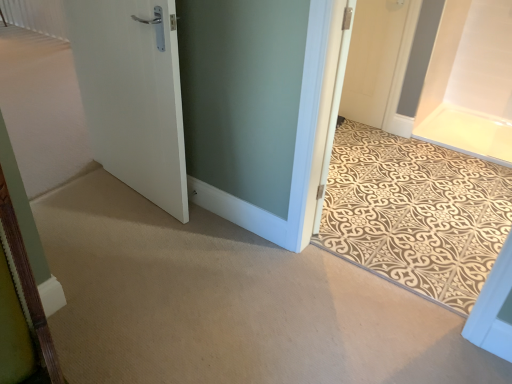
Measure the distance between point [383,45] and camera.

A distance of 2.92 meters exists between point [383,45] and camera.

Find the location of `white matte door at left, marked as the 2th door in a front-to-back arrangement`. white matte door at left, marked as the 2th door in a front-to-back arrangement is located at coordinates tap(182, 117).

Is white matte door at upper right, acting as the 1th door starting from the back, completely or partially inside white matte door at left, which ranks as the second door in left-to-right order?

No, white matte door at left, which ranks as the second door in left-to-right order, does not contain white matte door at upper right, acting as the 1th door starting from the back.

From the image's perspective, which door is the 1st one above the white matte door at left, marked as the 1th door in a front-to-back arrangement? Please provide its 2D coordinates.

[(377, 59)]

Is white matte door at left, marked as the 1th door in a front-to-back arrangement, positioned before white matte door at upper right, which is the 1th door from right to left?

Yes, it is.

Consider the image. From the image's perspective, between white matte door at left, acting as the 3th door starting from the back, and white matte door at upper right, acting as the 3th door starting from the front, which one is located above?

From the image's view, white matte door at upper right, acting as the 3th door starting from the front, is above.

From their relative heights in the image, would you say beige patterned mat at center is taller or shorter than white matte door at upper right, acting as the 1th door starting from the back?

In the image, beige patterned mat at center appears to be taller than white matte door at upper right, acting as the 1th door starting from the back.

From a real-world perspective, who is located higher, beige patterned mat at center or white matte door at upper right, marked as the 3th door in a left-to-right arrangement?

From a 3D spatial view, beige patterned mat at center is above.

Is beige patterned mat at center to the right of white matte door at upper right, acting as the 1th door starting from the back, from the viewer's perspective?

No, beige patterned mat at center is not to the right of white matte door at upper right, acting as the 1th door starting from the back.

Does point (398, 162) appear closer or farther from the camera than point (402, 77)?

Point (398, 162) is closer to the camera than point (402, 77).

Are white matte door at left, marked as the 2th door in a front-to-back arrangement, and white matte door at left, which ranks as the second door in left-to-right order, making contact?

Indeed, white matte door at left, marked as the 2th door in a front-to-back arrangement, and white matte door at left, which ranks as the second door in left-to-right order, are beside each other and touching.

Could you tell me if white matte door at left, marked as the 2th door in a front-to-back arrangement, is facing white matte door at left, which ranks as the second door in left-to-right order?

No, white matte door at left, marked as the 2th door in a front-to-back arrangement, is not aimed at white matte door at left, which ranks as the second door in left-to-right order.

Is white matte door at left, arranged as the 1th door when viewed from the left, bigger than white matte door at left, positioned as the second door in right-to-left order?

Correct, white matte door at left, arranged as the 1th door when viewed from the left, is larger in size than white matte door at left, positioned as the second door in right-to-left order.

From a real-world perspective, is white matte door at left, the 2th door from the back, positioned under white matte door at left, marked as the 1th door in a front-to-back arrangement, based on gravity?

Yes.

Considering the relative positions of white matte door at left, arranged as the 1th door when viewed from the left, and white matte door at upper right, acting as the 3th door starting from the front, in the image provided, is white matte door at left, arranged as the 1th door when viewed from the left, to the right of white matte door at upper right, acting as the 3th door starting from the front, from the viewer's perspective?

No.

From the picture: In terms of size, does white matte door at left, the 3th door from the right, appear bigger or smaller than white matte door at upper right, which is the 1th door from right to left?

Clearly, white matte door at left, the 3th door from the right, is larger in size than white matte door at upper right, which is the 1th door from right to left.

From the image's perspective, is white matte door at left, the 2th door from the back, under white matte door at upper right, marked as the 3th door in a left-to-right arrangement?

No, from the image's perspective, white matte door at left, the 2th door from the back, is not beneath white matte door at upper right, marked as the 3th door in a left-to-right arrangement.

Measure the distance from white matte door at left, the 2th door from the back, to white matte door at upper right, acting as the 1th door starting from the back.

The distance of white matte door at left, the 2th door from the back, from white matte door at upper right, acting as the 1th door starting from the back, is 4.99 feet.

Is white matte door at left, marked as the 1th door in a front-to-back arrangement, positioned beyond the bounds of beige patterned mat at center?

white matte door at left, marked as the 1th door in a front-to-back arrangement, is positioned outside beige patterned mat at center.

Is there a large distance between white matte door at left, marked as the 1th door in a front-to-back arrangement, and beige patterned mat at center?

Absolutely, white matte door at left, marked as the 1th door in a front-to-back arrangement, is distant from beige patterned mat at center.

Is white matte door at upper right, acting as the 1th door starting from the back, not near white matte door at left, positioned as the second door in right-to-left order?

Yes, white matte door at upper right, acting as the 1th door starting from the back, and white matte door at left, positioned as the second door in right-to-left order, are located far from each other.

Based on the photo, from the image's perspective, which one is positioned higher, white matte door at upper right, acting as the 3th door starting from the front, or white matte door at left, acting as the 3th door starting from the back?

white matte door at upper right, acting as the 3th door starting from the front, appears higher in the image.

This screenshot has height=384, width=512. I want to click on door above the white matte door at upper right, which is the 1th door from right to left (from a real-world perspective), so click(x=133, y=94).

Relative to white matte door at left, which ranks as the second door in left-to-right order, is white matte door at upper right, which is the 1th door from right to left, in front or behind?

Clearly, white matte door at upper right, which is the 1th door from right to left, is behind white matte door at left, which ranks as the second door in left-to-right order.

Is white matte door at left, marked as the 1th door in a front-to-back arrangement, positioned with its back to white matte door at left, the 2th door from the back?

white matte door at left, marked as the 1th door in a front-to-back arrangement, is not turned away from white matte door at left, the 2th door from the back.

Which of these two, white matte door at left, marked as the 1th door in a front-to-back arrangement, or white matte door at left, marked as the 2th door in a front-to-back arrangement, is thinner?

white matte door at left, marked as the 1th door in a front-to-back arrangement, is thinner.

Considering the positions of point (114, 143) and point (136, 49), is point (114, 143) closer or farther from the camera than point (136, 49)?

Point (114, 143) is farther from the camera than point (136, 49).

Image resolution: width=512 pixels, height=384 pixels. Find the location of `the 2nd door behind the white matte door at left, which ranks as the second door in left-to-right order, starting your count from the anchor`. the 2nd door behind the white matte door at left, which ranks as the second door in left-to-right order, starting your count from the anchor is located at coordinates (377, 59).

What are the coordinates of `doormat lying in front of the white matte door at upper right, marked as the 3th door in a left-to-right arrangement` in the screenshot? It's located at (415, 213).

Which object lies nearer to the anchor point beige patterned mat at center, white matte door at left, marked as the 1th door in a front-to-back arrangement, or white matte door at upper right, marked as the 3th door in a left-to-right arrangement?

The object closer to beige patterned mat at center is white matte door at upper right, marked as the 3th door in a left-to-right arrangement.

From the image, which object appears to be nearer to white matte door at left, which ranks as the second door in left-to-right order, white matte door at left, the 2th door from the back, or beige patterned mat at center?

The object closer to white matte door at left, which ranks as the second door in left-to-right order, is white matte door at left, the 2th door from the back.

Based on their spatial positions, is beige patterned mat at center or white matte door at left, arranged as the 1th door when viewed from the left, closer to white matte door at left, which ranks as the second door in left-to-right order?

white matte door at left, arranged as the 1th door when viewed from the left, is closer to white matte door at left, which ranks as the second door in left-to-right order.

From the image, which object appears to be nearer to white matte door at left, which ranks as the second door in left-to-right order, white matte door at upper right, acting as the 3th door starting from the front, or white matte door at left, arranged as the 1th door when viewed from the left?

white matte door at left, arranged as the 1th door when viewed from the left, is closer to white matte door at left, which ranks as the second door in left-to-right order.

Looking at the image, which one is located closer to white matte door at left, marked as the 1th door in a front-to-back arrangement, white matte door at left, the 3th door from the right, or white matte door at upper right, which is the 1th door from right to left?

Based on the image, white matte door at left, the 3th door from the right, appears to be nearer to white matte door at left, marked as the 1th door in a front-to-back arrangement.

Based on their spatial positions, is beige patterned mat at center or white matte door at upper right, which is the 1th door from right to left, further from white matte door at left, arranged as the 1th door when viewed from the left?

Based on the image, white matte door at upper right, which is the 1th door from right to left, appears to be further to white matte door at left, arranged as the 1th door when viewed from the left.

Estimate the real-world distances between objects in this image. Which object is closer to beige patterned mat at center, white matte door at left, arranged as the 1th door when viewed from the left, or white matte door at left, marked as the 1th door in a front-to-back arrangement?

white matte door at left, arranged as the 1th door when viewed from the left, lies closer to beige patterned mat at center than the other object.

From the image, which object appears to be nearer to white matte door at left, positioned as the second door in right-to-left order, beige patterned mat at center or white matte door at upper right, acting as the 3th door starting from the front?

beige patterned mat at center is closer to white matte door at left, positioned as the second door in right-to-left order.

Find the location of a particular element. door between white matte door at left, the 3th door from the right, and beige patterned mat at center from left to right is located at coordinates coord(133,94).

This screenshot has width=512, height=384. I want to click on doormat situated between white matte door at left, arranged as the 1th door when viewed from the left, and white matte door at upper right, acting as the 3th door starting from the front, from left to right, so click(x=415, y=213).

What are the coordinates of `door between white matte door at left, the 3th door from the right, and white matte door at upper right, acting as the 1th door starting from the back` in the screenshot? It's located at (133, 94).